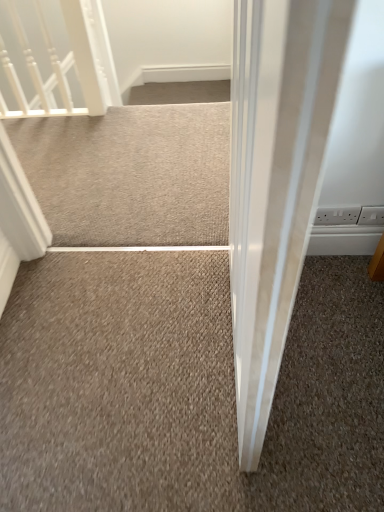
What do you see at coordinates (46, 58) in the screenshot? I see `white glossy rail at upper left` at bounding box center [46, 58].

Where is `white glossy rail at upper left`? white glossy rail at upper left is located at coordinates (46, 58).

Locate an element on the screen. white plastic electric outlet at upper right, which ranks as the 2th electric outlet in right-to-left order is located at coordinates (337, 215).

The width and height of the screenshot is (384, 512). What do you see at coordinates (130, 174) in the screenshot?
I see `beige carpet at center` at bounding box center [130, 174].

The width and height of the screenshot is (384, 512). I want to click on white glossy rail at upper left, so click(x=46, y=58).

Can you confirm if white plastic electric outlet at right, which is the 1th electric outlet from right to left, is thinner than white plastic electric outlet at upper right, acting as the first electric outlet starting from the left?

No.

Is white plastic electric outlet at right, the 2th electric outlet from the left, at the left side of white plastic electric outlet at upper right, acting as the first electric outlet starting from the left?

No.

Based on their sizes in the image, would you say white plastic electric outlet at right, which is the 1th electric outlet from right to left, is bigger or smaller than white plastic electric outlet at upper right, acting as the first electric outlet starting from the left?

In the image, white plastic electric outlet at right, which is the 1th electric outlet from right to left, appears to be larger than white plastic electric outlet at upper right, acting as the first electric outlet starting from the left.

Is white plastic electric outlet at upper right, which ranks as the 2th electric outlet in right-to-left order, in front of white glossy rail at upper left?

Yes, it is.

From a real-world perspective, which object stands above the other?

From a 3D spatial view, white glossy rail at upper left is above.

Is white plastic electric outlet at upper right, acting as the first electric outlet starting from the left, at the right side of white glossy rail at upper left?

Indeed, white plastic electric outlet at upper right, acting as the first electric outlet starting from the left, is positioned on the right side of white glossy rail at upper left.

Which of these two, white plastic electric outlet at upper right, which ranks as the 2th electric outlet in right-to-left order, or white plastic electric outlet at right, which is the 1th electric outlet from right to left, stands shorter?

white plastic electric outlet at upper right, which ranks as the 2th electric outlet in right-to-left order, is shorter.

Does white plastic electric outlet at upper right, acting as the first electric outlet starting from the left, have a larger size compared to white plastic electric outlet at right, which is the 1th electric outlet from right to left?

No, white plastic electric outlet at upper right, acting as the first electric outlet starting from the left, is not bigger than white plastic electric outlet at right, which is the 1th electric outlet from right to left.

Is point (340, 217) closer or farther from the camera than point (369, 212)?

Point (340, 217) appears to be farther away from the viewer than point (369, 212).

Considering the positions of objects white plastic electric outlet at upper right, which ranks as the 2th electric outlet in right-to-left order, and white plastic electric outlet at right, the 2th electric outlet from the left, in the image provided, who is more to the right, white plastic electric outlet at upper right, which ranks as the 2th electric outlet in right-to-left order, or white plastic electric outlet at right, the 2th electric outlet from the left,?

From the viewer's perspective, white plastic electric outlet at right, the 2th electric outlet from the left, appears more on the right side.

Looking at the image, does beige carpet at center seem bigger or smaller compared to white plastic electric outlet at right, the 2th electric outlet from the left?

Clearly, beige carpet at center is larger in size than white plastic electric outlet at right, the 2th electric outlet from the left.

Is white plastic electric outlet at right, the 2th electric outlet from the left, at the back of beige carpet at center?

No, beige carpet at center is not facing away from white plastic electric outlet at right, the 2th electric outlet from the left.

Which is closer, (134, 228) or (367, 207)?

The point (367, 207) is closer.

Is white glossy rail at upper left turned away from white plastic electric outlet at right, the 2th electric outlet from the left?

No, white glossy rail at upper left is not facing away from white plastic electric outlet at right, the 2th electric outlet from the left.

From the image's perspective, relative to white plastic electric outlet at right, which is the 1th electric outlet from right to left, is white glossy rail at upper left above or below?

Clearly, from the image's perspective, white glossy rail at upper left is above white plastic electric outlet at right, which is the 1th electric outlet from right to left.

Looking at this image, which object is more forward, white glossy rail at upper left or white plastic electric outlet at right, which is the 1th electric outlet from right to left?

Positioned in front is white plastic electric outlet at right, which is the 1th electric outlet from right to left.

Which object is thinner, white glossy rail at upper left or white plastic electric outlet at right, which is the 1th electric outlet from right to left?

With smaller width is white plastic electric outlet at right, which is the 1th electric outlet from right to left.

Can you confirm if white glossy rail at upper left is bigger than beige carpet at center?

Yes, white glossy rail at upper left is bigger than beige carpet at center.

Is beige carpet at center a part of white glossy rail at upper left?

That's incorrect, beige carpet at center is not inside white glossy rail at upper left.

Is white glossy rail at upper left placed right next to beige carpet at center?

white glossy rail at upper left is not next to beige carpet at center, and they're not touching.

Can you confirm if beige carpet at center is taller than white plastic electric outlet at upper right, acting as the first electric outlet starting from the left?

No, beige carpet at center is not taller than white plastic electric outlet at upper right, acting as the first electric outlet starting from the left.

I want to click on doormat on the left of white plastic electric outlet at upper right, which ranks as the 2th electric outlet in right-to-left order, so click(130, 174).

From a real-world perspective, is beige carpet at center physically located above or below white plastic electric outlet at upper right, which ranks as the 2th electric outlet in right-to-left order?

beige carpet at center is below white plastic electric outlet at upper right, which ranks as the 2th electric outlet in right-to-left order.

Consider the image. Is white plastic electric outlet at upper right, which ranks as the 2th electric outlet in right-to-left order, at the back of beige carpet at center?

No, beige carpet at center's orientation is not away from white plastic electric outlet at upper right, which ranks as the 2th electric outlet in right-to-left order.

Where is `electric outlet located below the white plastic electric outlet at right, the 2th electric outlet from the left (from the image's perspective)`? This screenshot has width=384, height=512. electric outlet located below the white plastic electric outlet at right, the 2th electric outlet from the left (from the image's perspective) is located at coordinates (337, 215).

Where is `the 1st electric outlet counting from the right side of the white glossy rail at upper left`? the 1st electric outlet counting from the right side of the white glossy rail at upper left is located at coordinates (337, 215).

Which object lies nearer to the anchor point white plastic electric outlet at upper right, which ranks as the 2th electric outlet in right-to-left order, white glossy rail at upper left or beige carpet at center?

beige carpet at center is closer to white plastic electric outlet at upper right, which ranks as the 2th electric outlet in right-to-left order.

Looking at the image, which one is located further to white glossy rail at upper left, beige carpet at center or white plastic electric outlet at upper right, which ranks as the 2th electric outlet in right-to-left order?

white plastic electric outlet at upper right, which ranks as the 2th electric outlet in right-to-left order, lies further to white glossy rail at upper left than the other object.

Estimate the real-world distances between objects in this image. Which object is further from white glossy rail at upper left, beige carpet at center or white plastic electric outlet at right, which is the 1th electric outlet from right to left?

The object further to white glossy rail at upper left is white plastic electric outlet at right, which is the 1th electric outlet from right to left.

Which object lies further to the anchor point beige carpet at center, white plastic electric outlet at right, the 2th electric outlet from the left, or white glossy rail at upper left?

Among the two, white plastic electric outlet at right, the 2th electric outlet from the left, is located further to beige carpet at center.

When comparing their distances from white plastic electric outlet at right, which is the 1th electric outlet from right to left, does beige carpet at center or white glossy rail at upper left seem closer?

beige carpet at center lies closer to white plastic electric outlet at right, which is the 1th electric outlet from right to left, than the other object.

Estimate the real-world distances between objects in this image. Which object is closer to beige carpet at center, white plastic electric outlet at upper right, acting as the first electric outlet starting from the left, or white plastic electric outlet at right, the 2th electric outlet from the left?

white plastic electric outlet at upper right, acting as the first electric outlet starting from the left, lies closer to beige carpet at center than the other object.

Looking at the image, which one is located further to white plastic electric outlet at right, which is the 1th electric outlet from right to left, white glossy rail at upper left or beige carpet at center?

Based on the image, white glossy rail at upper left appears to be further to white plastic electric outlet at right, which is the 1th electric outlet from right to left.

Which object lies nearer to the anchor point white glossy rail at upper left, white plastic electric outlet at upper right, which ranks as the 2th electric outlet in right-to-left order, or white plastic electric outlet at right, which is the 1th electric outlet from right to left?

white plastic electric outlet at upper right, which ranks as the 2th electric outlet in right-to-left order, is closer to white glossy rail at upper left.

The width and height of the screenshot is (384, 512). I want to click on doormat located between white glossy rail at upper left and white plastic electric outlet at upper right, acting as the first electric outlet starting from the left, in the left-right direction, so click(130, 174).

Where is `electric outlet between white glossy rail at upper left and white plastic electric outlet at right, which is the 1th electric outlet from right to left, in the horizontal direction`? electric outlet between white glossy rail at upper left and white plastic electric outlet at right, which is the 1th electric outlet from right to left, in the horizontal direction is located at coordinates (337, 215).

The height and width of the screenshot is (512, 384). What are the coordinates of `electric outlet between beige carpet at center and white plastic electric outlet at right, the 2th electric outlet from the left, in the horizontal direction` in the screenshot? It's located at (337, 215).

What are the coordinates of `doormat between white glossy rail at upper left and white plastic electric outlet at right, the 2th electric outlet from the left, in the horizontal direction` in the screenshot? It's located at (130, 174).